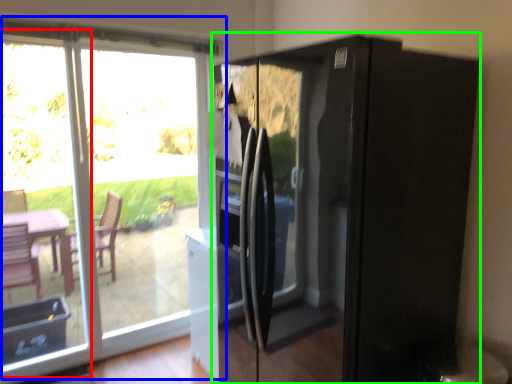
Question: Which is nearer to the glass door (highlighted by a red box)? window (highlighted by a blue box) or appliance (highlighted by a green box).

Choices:
 (A) window
 (B) appliance

Answer: (A)